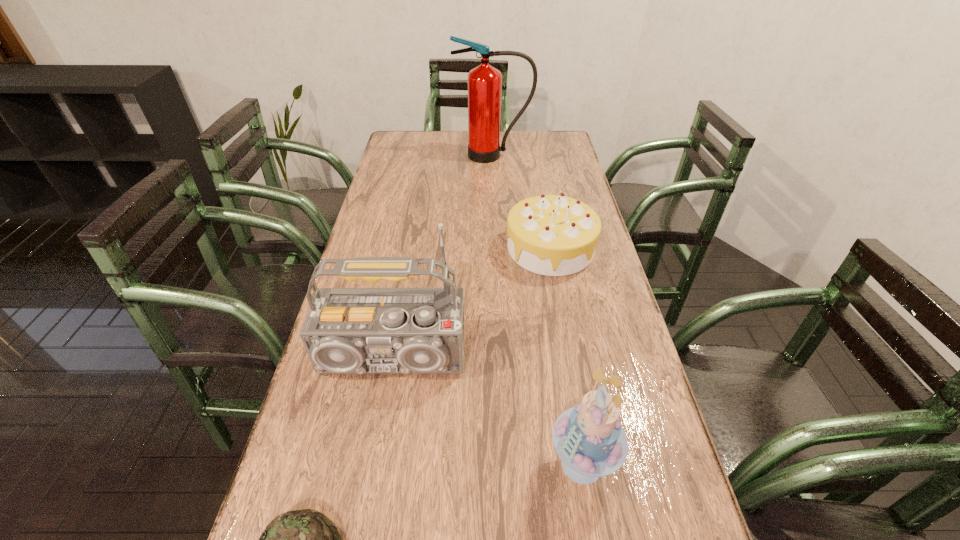
Where is `free space at the right edge of the desktop`? free space at the right edge of the desktop is located at coordinates (675, 539).

Where is `vacant space at the far left corner of the desktop`? vacant space at the far left corner of the desktop is located at coordinates (420, 150).

You are a GUI agent. You are given a task and a screenshot of the screen. Output one action in this format:
    pyautogui.click(x=<x>, y=<y>)
    Task: Click on the free region at the far right corner of the desktop
    
    Given the screenshot: What is the action you would take?
    pyautogui.click(x=535, y=138)

Where is `free space between the third shortest object and the fourth nearest object`? The width and height of the screenshot is (960, 540). free space between the third shortest object and the fourth nearest object is located at coordinates click(566, 356).

In order to click on free space between the fourth farthest object and the second tallest object in this screenshot , I will do `click(487, 414)`.

This screenshot has width=960, height=540. I want to click on vacant point located between the cake and the tallest object, so click(538, 309).

Where is `empty location between the third tallest object and the radio receiver`? The height and width of the screenshot is (540, 960). empty location between the third tallest object and the radio receiver is located at coordinates (487, 414).

Where is `object that stands as the third closest to the third shortest object`? The height and width of the screenshot is (540, 960). object that stands as the third closest to the third shortest object is located at coordinates (554, 235).

Where is `the second closest object to the second shortest object`? the second closest object to the second shortest object is located at coordinates (484, 82).